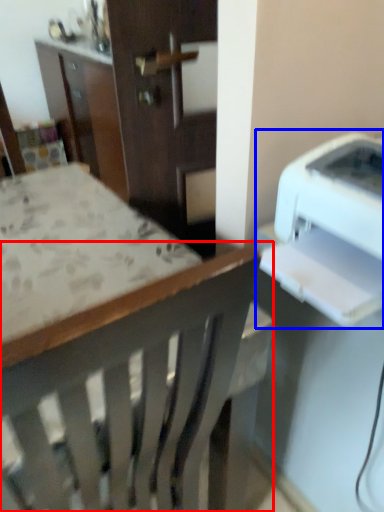
Question: Among these objects, which one is nearest to the camera, chair (highlighted by a red box) or printer (highlighted by a blue box)?

Choices:
 (A) chair
 (B) printer

Answer: (A)